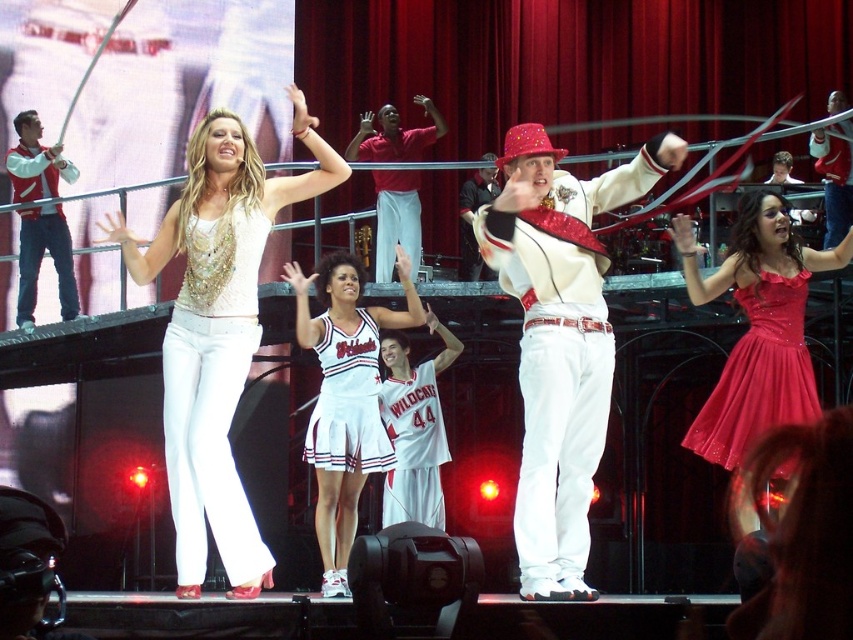
You are a photographer setting up a camera to capture the stage performance. You need to ensure that both the shiny red dress at right and the white fabric cheerleader outfit at center are fully visible in the frame. Based on their widths, which outfit should you position closer to the camera to avoid cropping?

The shiny red dress at right might be wider than the white fabric cheerleader outfit at center, so positioning the shiny red dress at right closer to the camera would help ensure it fits within the frame without cropping.

You are a photographer at the event and want to capture a photo that includes both the shiny red dress at right and the white fabric cheerleader outfit at center. Which object should you focus on first if you want to ensure both are in the frame?

You should focus on the white fabric cheerleader outfit at center first because the shiny red dress at right is positioned on the right side of it, so centering the outfit will help include both in the frame.

You are a photographer at the back of the stage. You want to take a photo of both the shiny sequined top at center and the shiny red dress at center. Which one should you zoom in on first to ensure they are both in focus?

The shiny sequined top at center might be wider than the shiny red dress at center, so you should zoom in on the shiny sequined top at center first to ensure both are in focus.